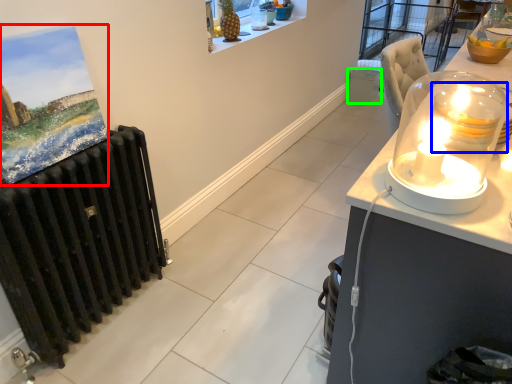
Question: Which object is the farthest from picture frame (highlighted by a red box)? Choose among these: candle holder (highlighted by a blue box) or trash bin/can (highlighted by a green box).

Choices:
 (A) candle holder
 (B) trash bin/can

Answer: (B)